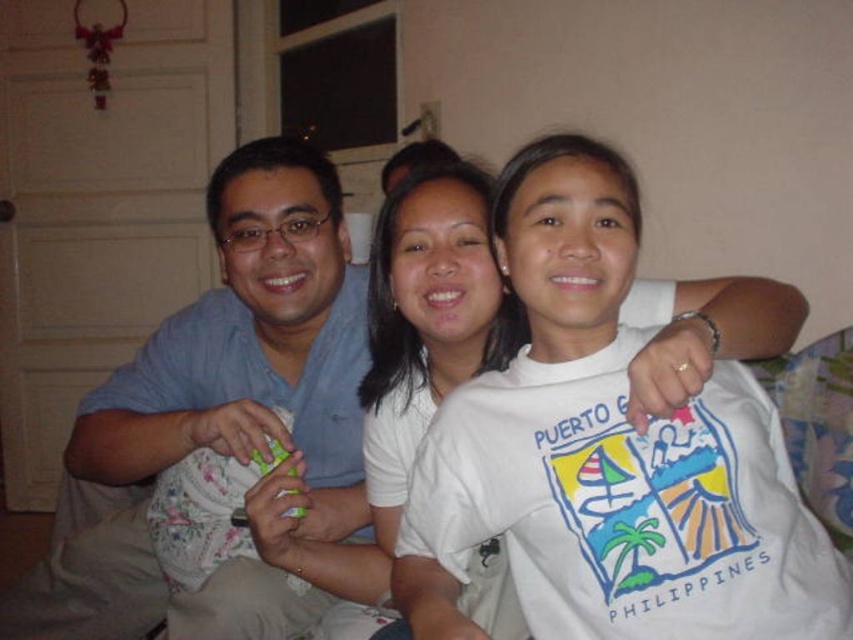
You are trying to decide which person is taller based on their shirts. The light blue cotton shirt at left and the white cotton shirt at center are in the image. Which shirt is taller?

The light blue cotton shirt at left is much taller than the white cotton shirt at center.

You are trying to decide which shirt to wear for a casual event. Both the light blue cotton shirt at left and the white cotton shirt at center are options. Based on the image, which one has a wider design?

The light blue cotton shirt at left might be wider than the white cotton shirt at center according to the image.